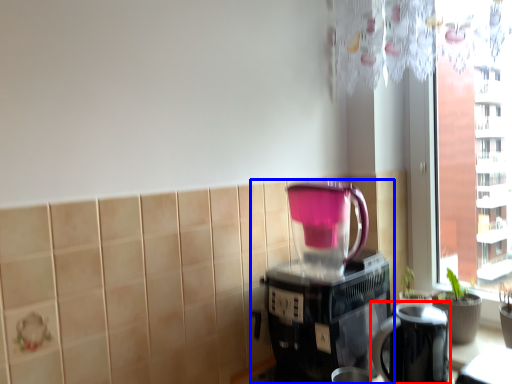
Question: Which of the following is the farthest to the observer, appliance (highlighted by a red box) or coffee maker (highlighted by a blue box)?

Choices:
 (A) appliance
 (B) coffee maker

Answer: (B)